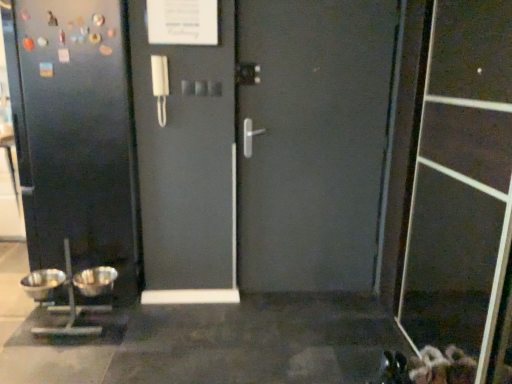
Question: From a real-world perspective, is silver metallic bowls at lower left positioned above or below transparent plastic screen door at lower right?

Choices:
 (A) above
 (B) below

Answer: (B)

Question: From the image's perspective, is silver metallic bowls at lower left above or below transparent plastic screen door at lower right?

Choices:
 (A) above
 (B) below

Answer: (B)

Question: Estimate the real-world distances between objects in this image. Which object is farther from the silver metallic mixing bowl at lower left, marked as the 1th mixing bowl in a right-to-left arrangement?

Choices:
 (A) silver metallic bowls at lower left
 (B) metallic gray door at center
 (C) silver metallic mixing bowl at lower left, the 2th mixing bowl when ordered from right to left
 (D) transparent plastic screen door at lower right

Answer: (D)

Question: Which object is the closest to the silver metallic mixing bowl at lower left, marked as the 1th mixing bowl in a right-to-left arrangement?

Choices:
 (A) silver metallic mixing bowl at lower left, which appears as the 1th mixing bowl when viewed from the left
 (B) silver metallic bowls at lower left
 (C) metallic gray door at center
 (D) transparent plastic screen door at lower right

Answer: (B)